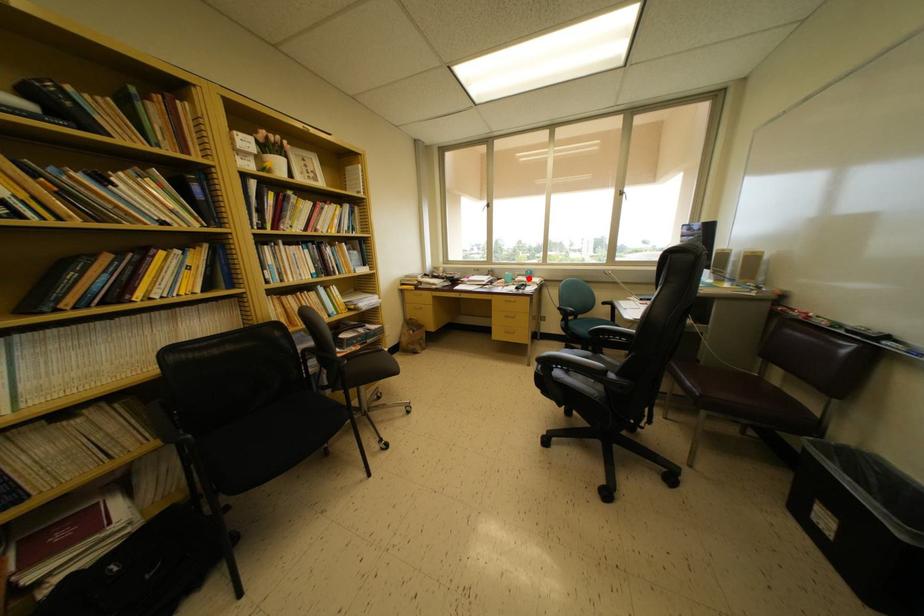
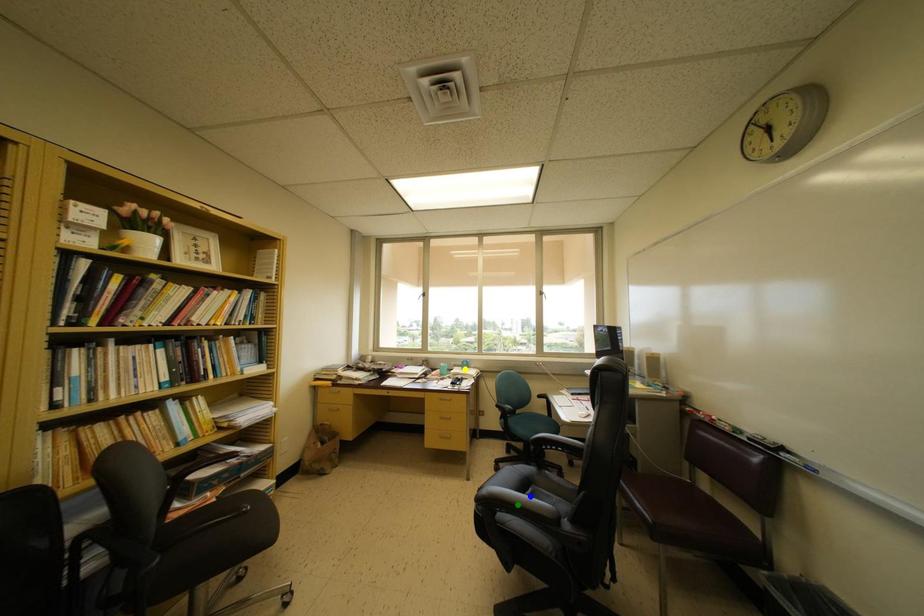
Question: I am providing you with two images of the same scene from different viewpoints. A red point is marked on the first image. You are given multiple points on the second image. Which mark in image 2 goes with the point in image 1?

Choices:
 (A) green point
 (B) blue point
 (C) yellow point

Answer: (C)